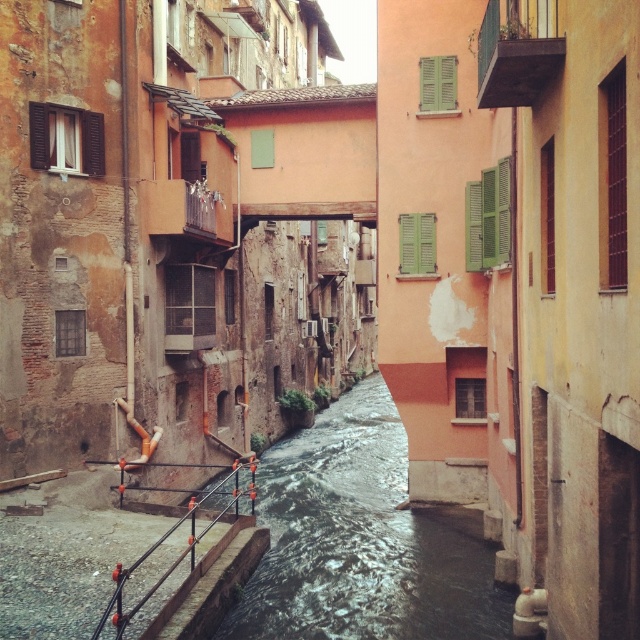
You are a tour guide explaining the architecture of the historic buildings in the scene. You mention the green matte shutters at upper center and the red accents on the black railing. How far apart are these two architectural elements?

The green matte shutters at upper center and the red accents on the black railing are 15.14 meters apart.

You are standing on the staircase with a black railing and red accents on the left side of the canal. You want to take a photo of the green matte shutters at upper center. Which direction should you face to capture them in your viewfinder?

You should face towards the right side of the canal from the staircase to capture the green matte shutters at upper center, as they are located at point coordinates of (488, 218) relative to the image frame.

You are standing at the bottom of the staircase on the left side of the canal. Looking up, you see the green matte shutters at upper center marked by point (488, 218). What direction would you face to look directly at the green matte shutters at upper center?

You should face towards the upper center direction to look directly at the green matte shutters at upper center marked by point (488, 218).